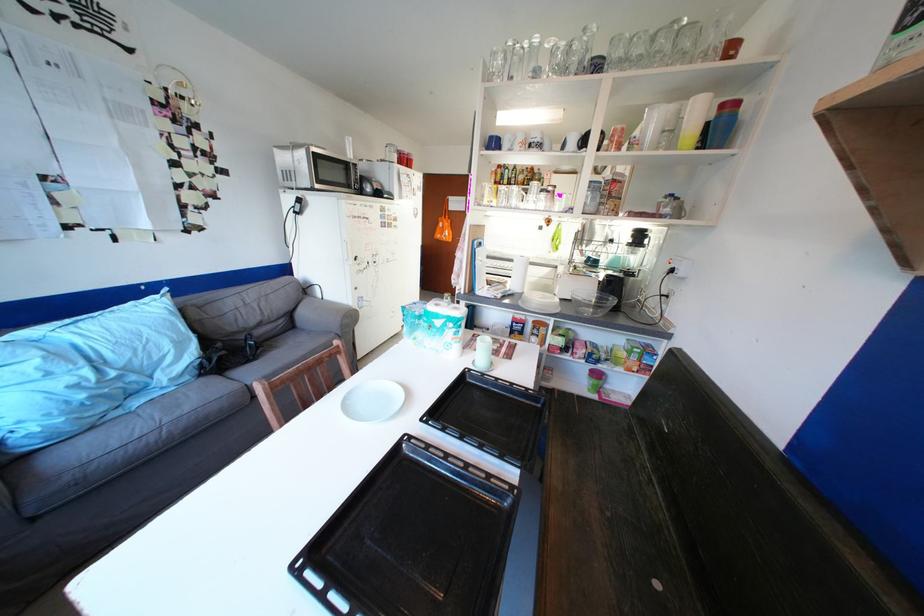
Find where to rest on the grey sofa armrest. Please return your answer as a coordinate pair (x, y).

(323, 315)